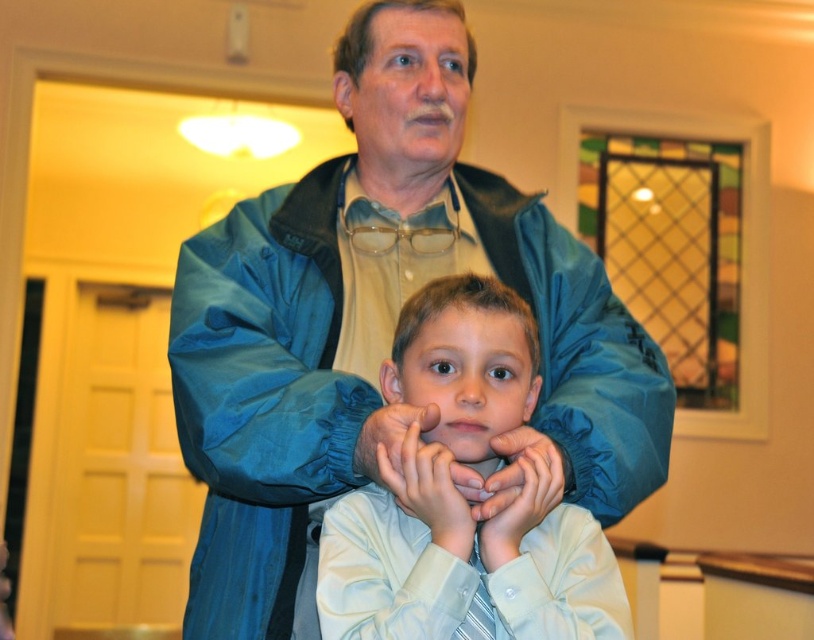
Is blue nylon jacket at center taller than blue fabric hand at center?

Yes.

Which is above, blue nylon jacket at center or blue fabric hand at center?

Positioned higher is blue nylon jacket at center.

Image resolution: width=814 pixels, height=640 pixels. I want to click on blue nylon jacket at center, so click(379, 324).

Identify the location of blue nylon jacket at center. (379, 324).

Does light blue shirt at center have a lesser width compared to matte skin hand at center?

No, light blue shirt at center is not thinner than matte skin hand at center.

Can you confirm if light blue shirt at center is shorter than matte skin hand at center?

Incorrect, light blue shirt at center's height does not fall short of matte skin hand at center's.

What do you see at coordinates (462, 499) in the screenshot? Image resolution: width=814 pixels, height=640 pixels. I see `light blue shirt at center` at bounding box center [462, 499].

Identify the location of light blue shirt at center. (462, 499).

Who is higher up, light blue shirt at center or matte blue hand at center?

light blue shirt at center is above.

Can you confirm if light blue shirt at center is wider than matte blue hand at center?

Yes, light blue shirt at center is wider than matte blue hand at center.

Identify the location of light blue shirt at center. pyautogui.click(x=462, y=499).

The width and height of the screenshot is (814, 640). Find the location of `light blue shirt at center`. light blue shirt at center is located at coordinates (462, 499).